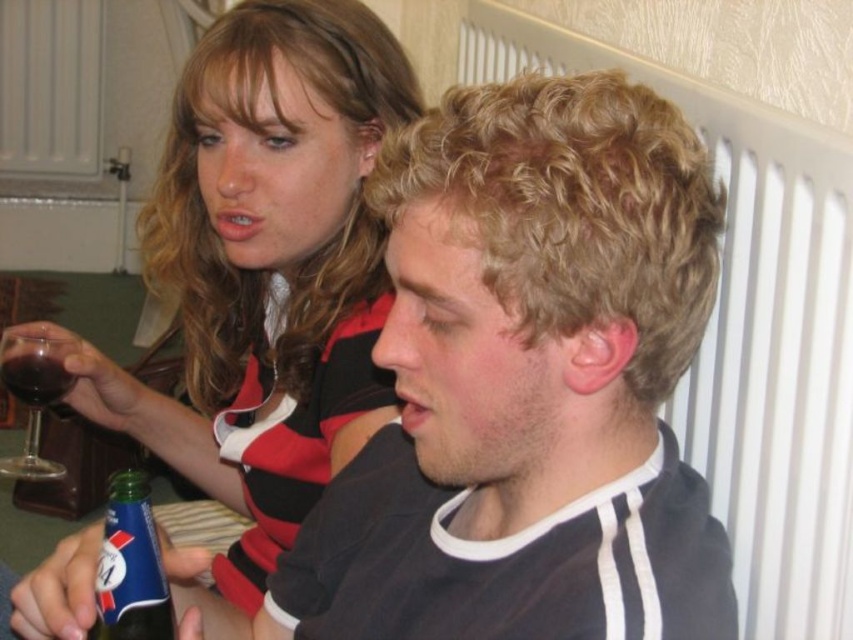
Does matte black shirt at upper left have a greater width compared to transparent glass wine glass at left?

Correct, the width of matte black shirt at upper left exceeds that of transparent glass wine glass at left.

From the picture: Does matte black shirt at upper left appear under transparent glass wine glass at left?

Incorrect, matte black shirt at upper left is not positioned below transparent glass wine glass at left.

The width and height of the screenshot is (853, 640). In order to click on matte black shirt at upper left in this screenshot , I will do tap(265, 268).

Locate an element on the screen. Image resolution: width=853 pixels, height=640 pixels. matte black shirt at upper left is located at coordinates (265, 268).

The height and width of the screenshot is (640, 853). What do you see at coordinates (33, 396) in the screenshot?
I see `transparent glass wine glass at left` at bounding box center [33, 396].

Is point (28, 378) positioned behind point (0, 378)?

Yes, point (28, 378) is farther from viewer.

This screenshot has height=640, width=853. I want to click on transparent glass wine glass at left, so click(33, 396).

Is white plastic radiator at upper right further to camera compared to green glass bottle at lower left?

Yes, it is behind green glass bottle at lower left.

Is white plastic radiator at upper right smaller than green glass bottle at lower left?

Actually, white plastic radiator at upper right might be larger than green glass bottle at lower left.

At what (x,y) coordinates should I click in order to perform the action: click on white plastic radiator at upper right. Please return your answer as a coordinate pair (x, y). The height and width of the screenshot is (640, 853). Looking at the image, I should click on (749, 330).

Where is `white plastic radiator at upper right`? The height and width of the screenshot is (640, 853). white plastic radiator at upper right is located at coordinates point(749,330).